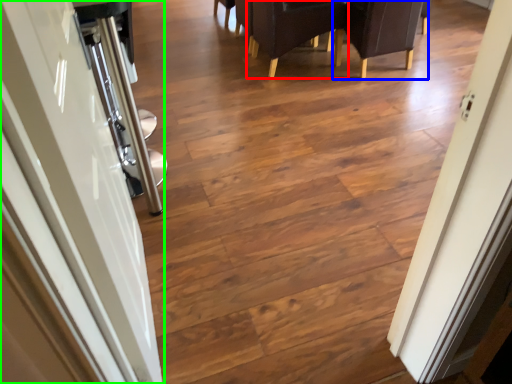
Question: Which is farther away from armchair (highlighted by a red box)? armchair (highlighted by a blue box) or door (highlighted by a green box)?

Choices:
 (A) armchair
 (B) door

Answer: (B)